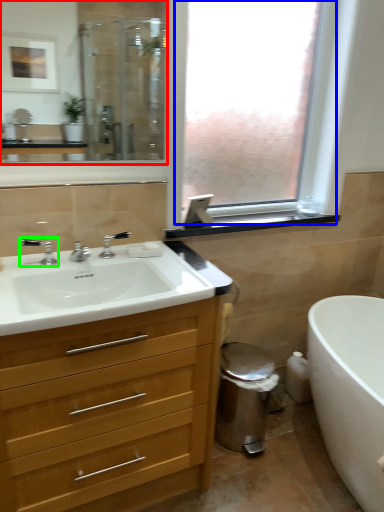
Question: Which object is positioned closest to mirror (highlighted by a red box)? Select from window (highlighted by a blue box) and tap (highlighted by a green box).

Choices:
 (A) window
 (B) tap

Answer: (A)